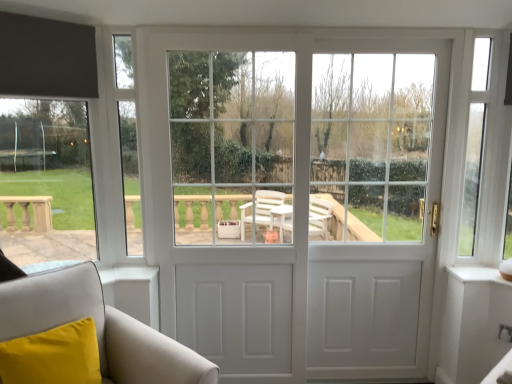
Question: Is white glossy door at right, which is the 1th screen door from right to left, not within white glossy door at center, which is the second screen door in right-to-left order?

Choices:
 (A) no
 (B) yes

Answer: (B)

Question: From the image's perspective, does white glossy door at right, which is the 1th screen door from right to left, appear higher than white glossy door at center, positioned as the 1th screen door in left-to-right order?

Choices:
 (A) yes
 (B) no

Answer: (A)

Question: Does white glossy door at right, which ranks as the second screen door in left-to-right order, come behind white glossy door at center, positioned as the 1th screen door in left-to-right order?

Choices:
 (A) yes
 (B) no

Answer: (A)

Question: Could you tell me if white glossy door at right, which is the 1th screen door from right to left, is turned towards white glossy door at center, which is the second screen door in right-to-left order?

Choices:
 (A) no
 (B) yes

Answer: (A)

Question: From a real-world perspective, is white glossy door at right, which ranks as the second screen door in left-to-right order, over white glossy door at center, which is the second screen door in right-to-left order?

Choices:
 (A) no
 (B) yes

Answer: (B)

Question: Considering the positions of white matte door at center and white leather armchair at lower left in the image, is white matte door at center bigger or smaller than white leather armchair at lower left?

Choices:
 (A) big
 (B) small

Answer: (B)

Question: Considering their positions, is white matte door at center located in front of or behind white leather armchair at lower left?

Choices:
 (A) front
 (B) behind

Answer: (B)

Question: From the image's perspective, is white matte door at center above or below white leather armchair at lower left?

Choices:
 (A) below
 (B) above

Answer: (B)

Question: From a real-world perspective, is white matte door at center physically located above or below white leather armchair at lower left?

Choices:
 (A) below
 (B) above

Answer: (B)

Question: From the image's perspective, is white glossy door at right, which is the 1th screen door from right to left, located above or below white matte door at center?

Choices:
 (A) above
 (B) below

Answer: (B)

Question: Is white glossy door at right, which ranks as the second screen door in left-to-right order, bigger or smaller than white matte door at center?

Choices:
 (A) big
 (B) small

Answer: (B)

Question: Considering their positions, is white glossy door at right, which ranks as the second screen door in left-to-right order, located in front of or behind white matte door at center?

Choices:
 (A) behind
 (B) front

Answer: (A)

Question: Is white glossy door at right, which ranks as the second screen door in left-to-right order, wider or thinner than white matte door at center?

Choices:
 (A) thin
 (B) wide

Answer: (B)

Question: Visually, is white glossy door at right, which is the 1th screen door from right to left, positioned to the left or to the right of white leather armchair at lower left?

Choices:
 (A) left
 (B) right

Answer: (B)

Question: Considering the positions of white glossy door at right, which is the 1th screen door from right to left, and white leather armchair at lower left in the image, is white glossy door at right, which is the 1th screen door from right to left, bigger or smaller than white leather armchair at lower left?

Choices:
 (A) big
 (B) small

Answer: (B)